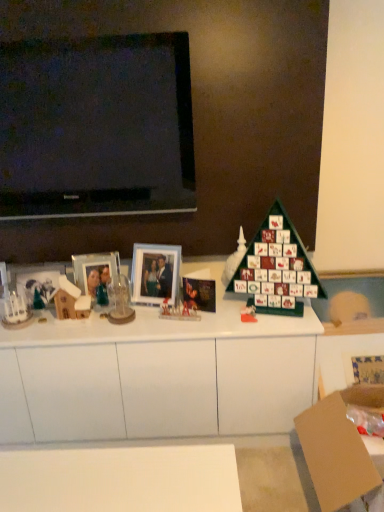
The height and width of the screenshot is (512, 384). What are the coordinates of `vacant area on top of white matte cabinet at center (from a real-world perspective)` in the screenshot? It's located at (135, 316).